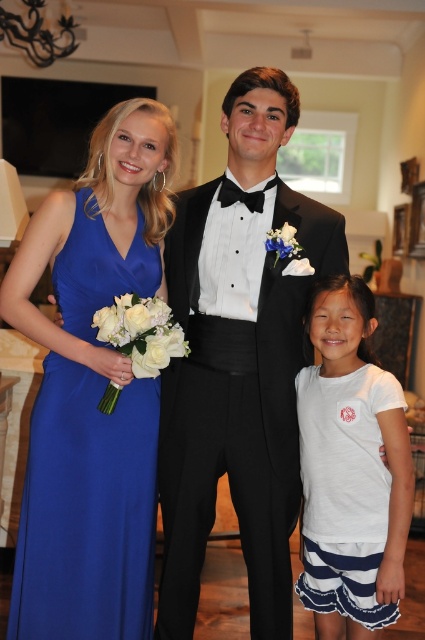
Question: Which object is the closest to the royal blue satin dress at left?

Choices:
 (A) white cotton shirt at center
 (B) black satin bow tie at center
 (C) black satin tuxedo at center

Answer: (C)

Question: Can you confirm if black satin tuxedo at center is positioned to the left of black satin bow tie at center?

Choices:
 (A) no
 (B) yes

Answer: (A)

Question: Which point is farther from the camera taking this photo?

Choices:
 (A) (218, 193)
 (B) (265, 84)
 (C) (391, 509)
 (D) (122, 502)

Answer: (A)

Question: Can you confirm if black satin tuxedo at center is smaller than white cotton shirt at center?

Choices:
 (A) yes
 (B) no

Answer: (B)

Question: Is white cotton shirt at center closer to camera compared to black satin bow tie at center?

Choices:
 (A) yes
 (B) no

Answer: (A)

Question: Which is farther from the royal blue satin dress at left?

Choices:
 (A) white cotton shirt at center
 (B) black satin bow tie at center

Answer: (B)